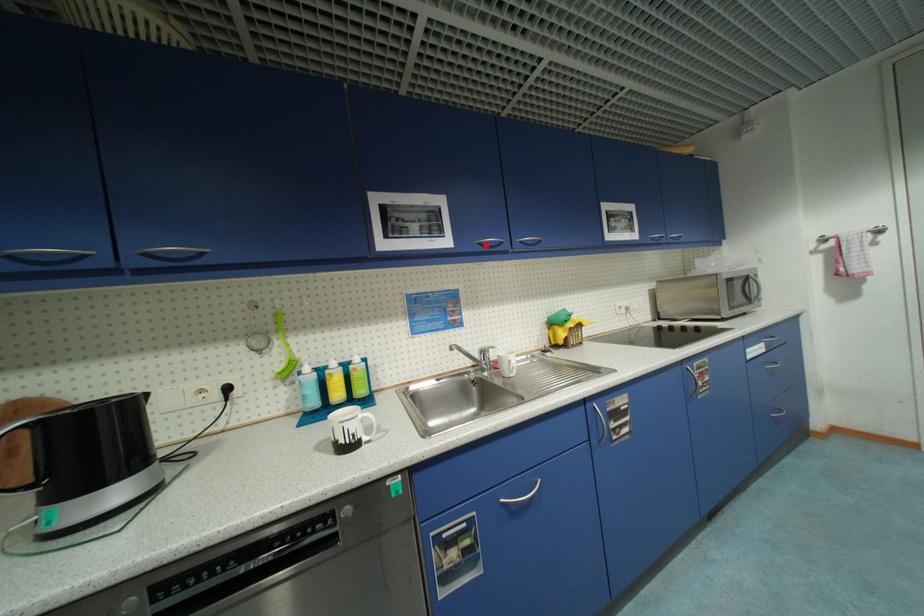
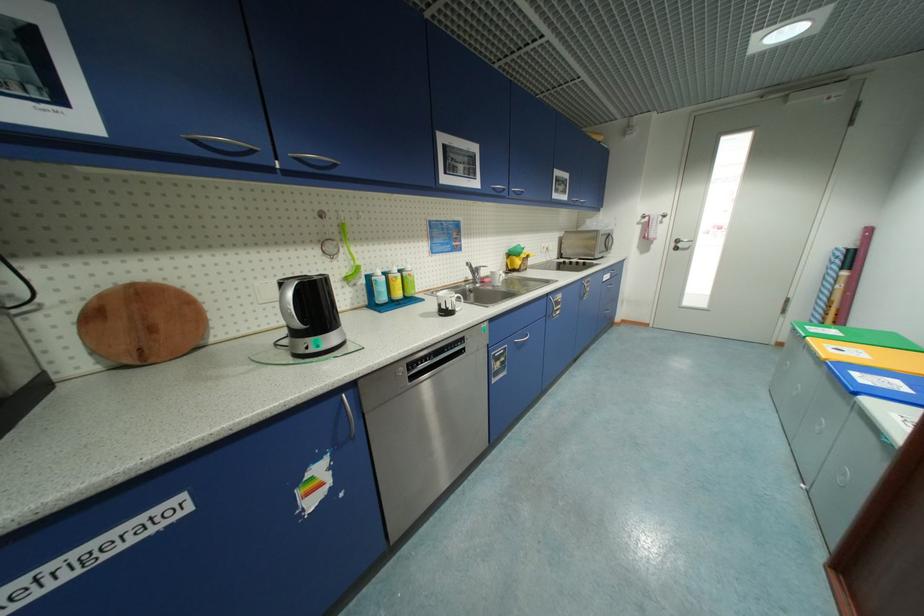
Locate, in the second image, the point that corresponds to the highlighted location in the first image.

(499, 190)